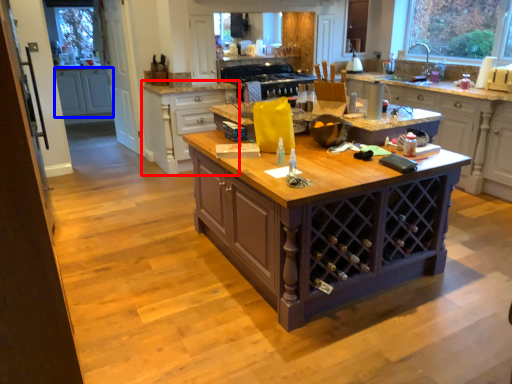
Question: Which point is further to the camera, cabinetry (highlighted by a red box) or cabinetry (highlighted by a blue box)?

Choices:
 (A) cabinetry
 (B) cabinetry

Answer: (B)